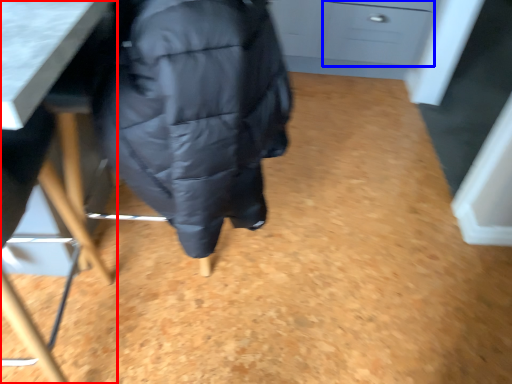
Question: Which object appears closest to the camera in this image, furniture (highlighted by a red box) or drawer (highlighted by a blue box)?

Choices:
 (A) furniture
 (B) drawer

Answer: (A)